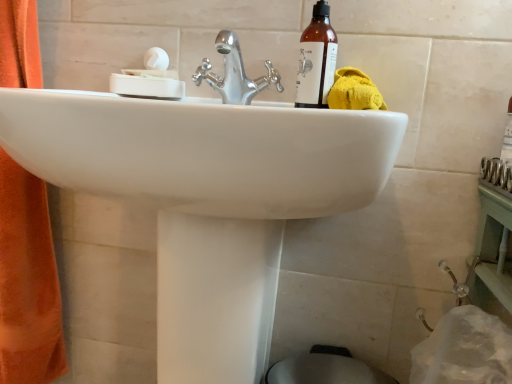
Question: From the image's perspective, is yellow fabric towel at upper right on brown glass bottle at upper right?

Choices:
 (A) yes
 (B) no

Answer: (B)

Question: Does yellow fabric towel at upper right have a smaller size compared to brown glass bottle at upper right?

Choices:
 (A) yes
 (B) no

Answer: (B)

Question: Is yellow fabric towel at upper right located outside brown glass bottle at upper right?

Choices:
 (A) no
 (B) yes

Answer: (B)

Question: Is yellow fabric towel at upper right shorter than brown glass bottle at upper right?

Choices:
 (A) no
 (B) yes

Answer: (B)

Question: Is yellow fabric towel at upper right surrounding brown glass bottle at upper right?

Choices:
 (A) yes
 (B) no

Answer: (B)

Question: Is yellow fabric towel at upper right to the left or to the right of white matte soap dish at upper left in the image?

Choices:
 (A) left
 (B) right

Answer: (B)

Question: From their relative heights in the image, would you say yellow fabric towel at upper right is taller or shorter than white matte soap dish at upper left?

Choices:
 (A) short
 (B) tall

Answer: (A)

Question: Based on their sizes in the image, would you say yellow fabric towel at upper right is bigger or smaller than white matte soap dish at upper left?

Choices:
 (A) big
 (B) small

Answer: (B)

Question: From a real-world perspective, is yellow fabric towel at upper right above or below white matte soap dish at upper left?

Choices:
 (A) below
 (B) above

Answer: (A)

Question: Considering the positions of white matte soap dish at upper left and chrome metallic faucet at center in the image, is white matte soap dish at upper left taller or shorter than chrome metallic faucet at center?

Choices:
 (A) tall
 (B) short

Answer: (B)

Question: Considering their positions, is white matte soap dish at upper left located in front of or behind chrome metallic faucet at center?

Choices:
 (A) front
 (B) behind

Answer: (B)

Question: From a real-world perspective, relative to chrome metallic faucet at center, is white matte soap dish at upper left vertically above or below?

Choices:
 (A) below
 (B) above

Answer: (A)

Question: From the image's perspective, is white matte soap dish at upper left located above or below chrome metallic faucet at center?

Choices:
 (A) above
 (B) below

Answer: (A)

Question: Choose the correct answer: Is brown glass bottle at upper right inside chrome metallic faucet at center or outside it?

Choices:
 (A) outside
 (B) inside

Answer: (A)

Question: From a real-world perspective, relative to chrome metallic faucet at center, is brown glass bottle at upper right vertically above or below?

Choices:
 (A) below
 (B) above

Answer: (B)